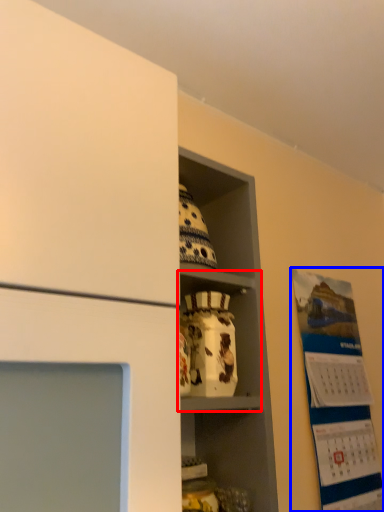
Question: Among these objects, which one is nearest to the camera, cabinet (highlighted by a red box) or bulletin board (highlighted by a blue box)?

Choices:
 (A) cabinet
 (B) bulletin board

Answer: (A)